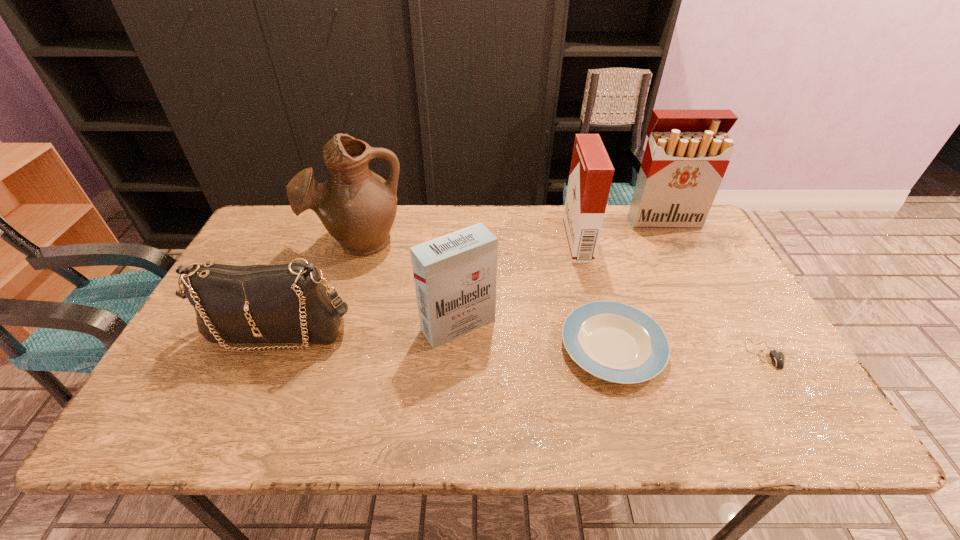
Identify the location of free spot between the third object from left to right and the rightmost cigarette case. Image resolution: width=960 pixels, height=540 pixels. (561, 273).

Find the location of a particular element. The width and height of the screenshot is (960, 540). empty space between the shortest object and the second cigarette case from right to left is located at coordinates (671, 298).

The image size is (960, 540). What are the coordinates of `free area in between the computer mouse and the handbag` in the screenshot? It's located at click(x=521, y=342).

Locate an element on the screen. vacant space in between the second shortest object and the shortest object is located at coordinates (688, 350).

What are the coordinates of `object that stands as the third closest to the computer mouse` in the screenshot? It's located at (687, 154).

Locate an element on the screen. The image size is (960, 540). object that is the second closest to the pitcher is located at coordinates (455, 275).

You are a GUI agent. You are given a task and a screenshot of the screen. Output one action in this format:
    pyautogui.click(x=<x>, y=<y>)
    Task: Click on the cigarette case that is the nearest to the leftmost cigarette case
    
    Given the screenshot: What is the action you would take?
    pyautogui.click(x=591, y=173)

I want to click on cigarette case that stands as the closest to the second shortest object, so click(x=455, y=275).

Locate an element on the screen. The image size is (960, 540). blank space that satisfies the following two spatial constraints: 1. at the spout of the pitcher; 2. on the right side of the fifth object from right to left is located at coordinates (332, 325).

You are a GUI agent. You are given a task and a screenshot of the screen. Output one action in this format:
    pyautogui.click(x=<x>, y=<y>)
    Task: Click on the vacant space that satisfies the following two spatial constraints: 1. on the front-facing side of the second cigarette case from right to left; 2. at the front of the handbag with chain and zipper
    This screenshot has width=960, height=540.
    Given the screenshot: What is the action you would take?
    pyautogui.click(x=600, y=331)